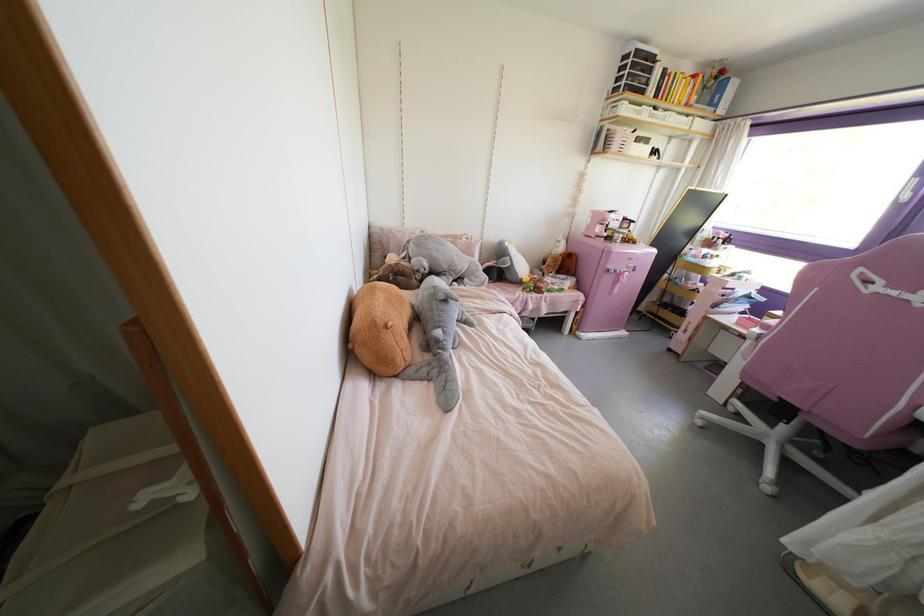
What are the coordinates of `yellow rolling cart` in the screenshot? It's located at (676, 292).